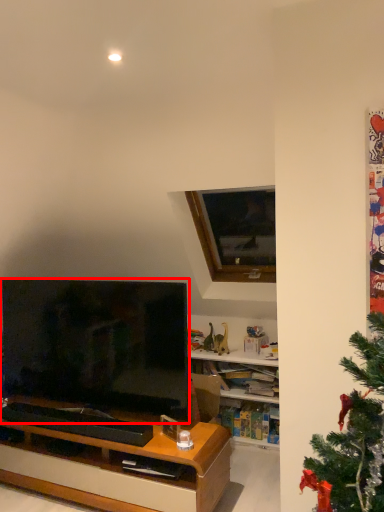
Question: From the image's perspective, what is the correct spatial positioning of television (annotated by the red box) in reference to window?

Choices:
 (A) below
 (B) above

Answer: (A)